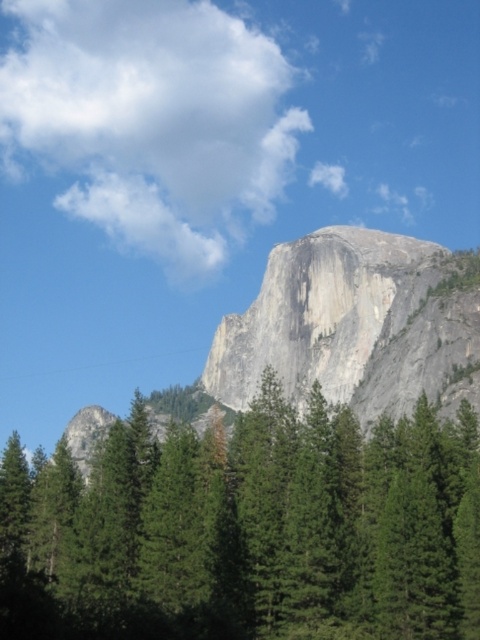
Does green matte trees at center have a greater height compared to gray/granite rock formation at center?

In fact, green matte trees at center may be shorter than gray/granite rock formation at center.

The height and width of the screenshot is (640, 480). I want to click on green matte trees at center, so click(248, 529).

Describe the element at coordinates (248, 529) in the screenshot. The width and height of the screenshot is (480, 640). I see `green matte trees at center` at that location.

Where is `green matte trees at center`? This screenshot has height=640, width=480. green matte trees at center is located at coordinates (x=248, y=529).